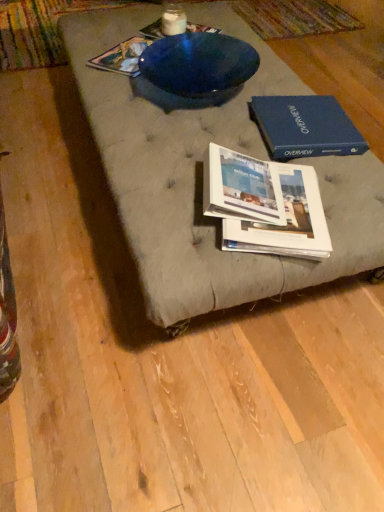
Question: Is the surface of blue glossy bowl at upper center, the first book positioned from the top, in direct contact with white glossy book at center, the third book viewed from the top?

Choices:
 (A) no
 (B) yes

Answer: (A)

Question: From the image's perspective, would you say blue glossy bowl at upper center, the 1th book when ordered from back to front, is positioned over white glossy book at center, which is the fourth book from back to front?

Choices:
 (A) yes
 (B) no

Answer: (A)

Question: From a real-world perspective, is blue glossy bowl at upper center, which is the fourth book from front to back, positioned over white glossy book at center, the third book viewed from the top, based on gravity?

Choices:
 (A) yes
 (B) no

Answer: (B)

Question: Is there a large distance between blue glossy bowl at upper center, marked as the fourth book in a bottom-to-top arrangement, and white glossy book at center, arranged as the first book when viewed from the front?

Choices:
 (A) no
 (B) yes

Answer: (A)

Question: Can you confirm if blue glossy bowl at upper center, which is the fourth book from front to back, is thinner than white glossy book at center, the second book positioned from the bottom?

Choices:
 (A) yes
 (B) no

Answer: (B)

Question: From the image's perspective, is blue glossy bowl at upper center, marked as the fourth book in a bottom-to-top arrangement, beneath white glossy book at center, arranged as the first book when viewed from the front?

Choices:
 (A) yes
 (B) no

Answer: (B)

Question: Does blue hardcover book at upper right have a smaller size compared to white glossy book at center, the third book viewed from the top?

Choices:
 (A) yes
 (B) no

Answer: (B)

Question: Can you confirm if blue hardcover book at upper right is positioned to the right of white glossy book at center, the second book positioned from the bottom?

Choices:
 (A) yes
 (B) no

Answer: (A)

Question: Is blue hardcover book at upper right facing away from white glossy book at center, the third book viewed from the top?

Choices:
 (A) yes
 (B) no

Answer: (B)

Question: Could you tell me if blue hardcover book at upper right is turned towards white glossy book at center, which is the fourth book from back to front?

Choices:
 (A) no
 (B) yes

Answer: (A)

Question: From the image's perspective, is blue hardcover book at upper right located above white glossy book at center, arranged as the first book when viewed from the front?

Choices:
 (A) no
 (B) yes

Answer: (B)

Question: Can you confirm if blue hardcover book at upper right is wider than white glossy book at center, the second book positioned from the bottom?

Choices:
 (A) no
 (B) yes

Answer: (B)

Question: Is white glossy book at center, which is counted as the 4th book, starting from the top, positioned in front of blue glossy bowl at upper center, the 1th book when ordered from back to front?

Choices:
 (A) no
 (B) yes

Answer: (B)